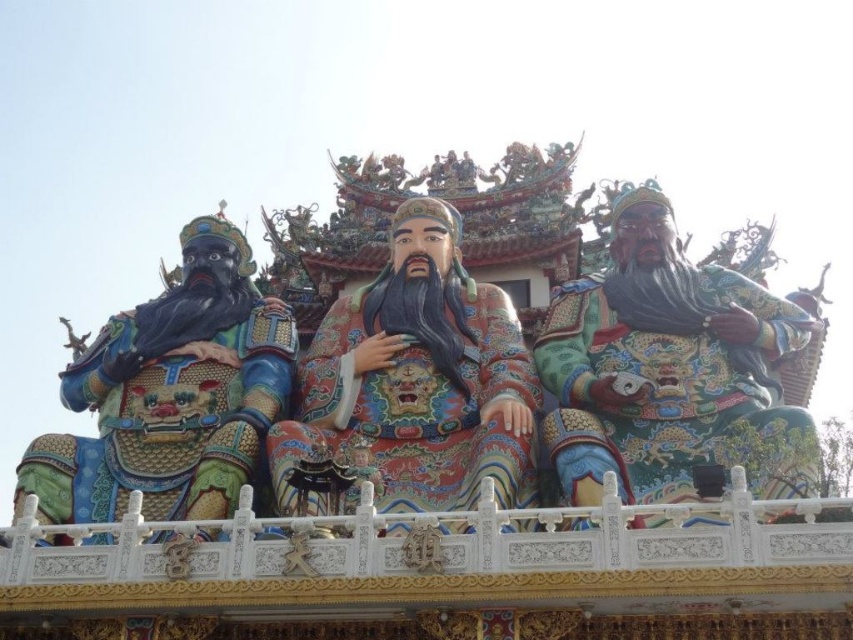
Question: Which of the following is the farthest from the observer?

Choices:
 (A) shiny green armor at right
 (B) multicolored painted statue at left

Answer: (B)

Question: Which point is farther from the camera taking this photo?

Choices:
 (A) (323, 392)
 (B) (207, 230)

Answer: (B)

Question: Can you confirm if shiny green armor at right is positioned to the right of multicolored painted statue at left?

Choices:
 (A) yes
 (B) no

Answer: (A)

Question: Does shiny green armor at right have a greater width compared to polychrome painted statue at center?

Choices:
 (A) no
 (B) yes

Answer: (B)

Question: Which is nearer to the shiny green armor at right?

Choices:
 (A) multicolored painted statue at left
 (B) polychrome painted statue at center

Answer: (B)

Question: Can you confirm if shiny green armor at right is positioned above multicolored painted statue at left?

Choices:
 (A) no
 (B) yes

Answer: (B)